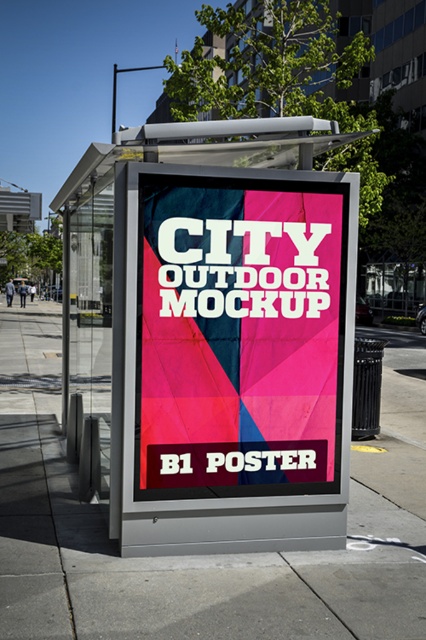
Question: Which point is farther to the camera?

Choices:
 (A) (268, 612)
 (B) (172, 352)
 (C) (201, 220)

Answer: (B)

Question: Is metallic silver bus stop at center further to camera compared to matte pink poster at center?

Choices:
 (A) yes
 (B) no

Answer: (B)

Question: Where is matte pink poster at center located in relation to matte gray pavement at center in the image?

Choices:
 (A) below
 (B) above

Answer: (B)

Question: Which object appears farthest from the camera in this image?

Choices:
 (A) metallic silver bus stop at center
 (B) matte pink poster at center

Answer: (B)

Question: Which point is closer to the camera?

Choices:
 (A) (94, 621)
 (B) (129, 484)

Answer: (A)

Question: Is matte pink poster at center to the left of matte gray pavement at center from the viewer's perspective?

Choices:
 (A) no
 (B) yes

Answer: (B)